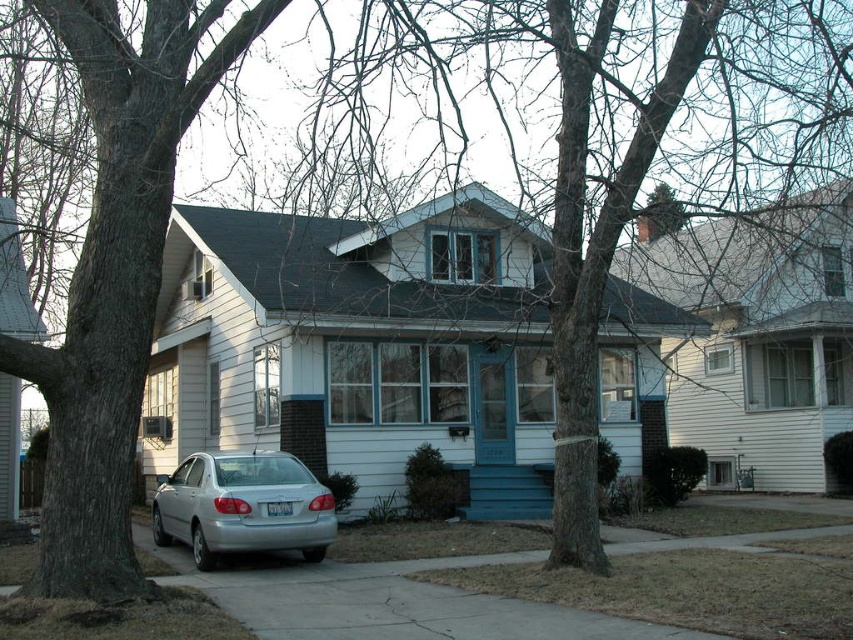
You are a drone operator trying to capture a photo of the house with the front door clearly visible. The smooth gray bark at left is blocking part of the door. Where should you position the drone to avoid the obstruction?

The smooth gray bark at left is located at point (x=115, y=276). To avoid the obstruction, position the drone to the right of the smooth gray bark at left so that the drone is not blocked by it.

You are a delivery person trying to deliver a package to the house with the teal blue front door. You see a smooth bark tree at center and a silver metallic sedan at center. Which object is closer to the front door?

The smooth bark tree at center is located above the silver metallic sedan at center, meaning the sedan is closer to the front door since it is below the tree.

You are a delivery person trying to locate the house number 1706. You see the smooth gray bark at left and the silver metallic sedan at center. Which object is closer to the house number on the door?

The silver metallic sedan at center is closer to the house number on the door because the smooth gray bark at left is to the right of the silver metallic sedan at center, meaning the sedan is positioned between the bark and the door.